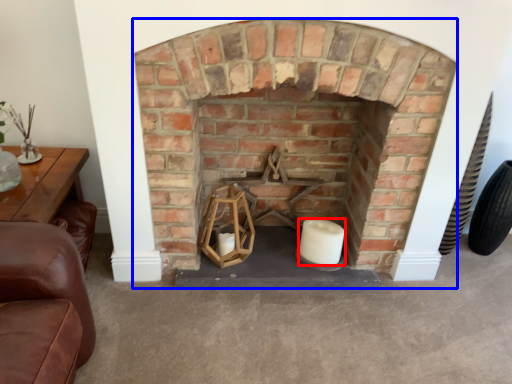
Question: Which object appears farthest to the camera in this image, candle (highlighted by a red box) or fireplace (highlighted by a blue box)?

Choices:
 (A) candle
 (B) fireplace

Answer: (A)